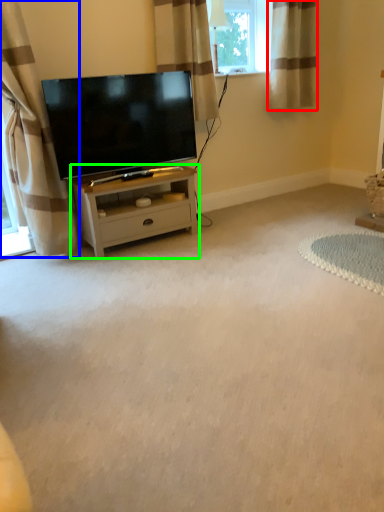
Question: Estimate the real-world distances between objects in this image. Which object is closer to curtain (highlighted by a red box), curtain (highlighted by a blue box) or nightstand (highlighted by a green box)?

Choices:
 (A) curtain
 (B) nightstand

Answer: (B)